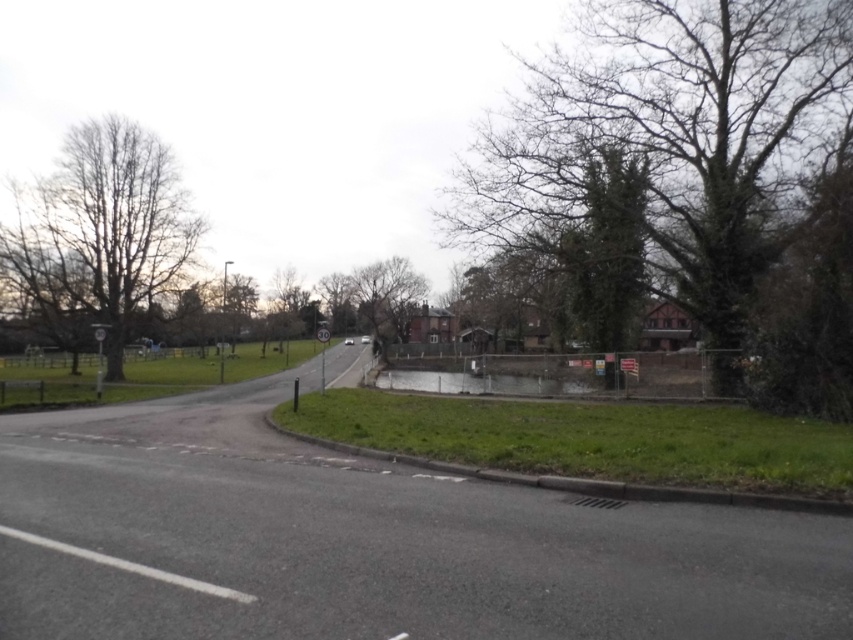
Question: Which point is farther to the camera?

Choices:
 (A) bare wood tree at left
 (B) bare branches at upper right

Answer: (A)

Question: Can you confirm if bare branches at upper right is positioned above bare wood tree at left?

Choices:
 (A) no
 (B) yes

Answer: (B)

Question: Which object is closer to the camera taking this photo?

Choices:
 (A) bare branches at upper right
 (B) bare wood tree at left

Answer: (A)

Question: Which of the following is the farthest from the observer?

Choices:
 (A) bare branches at upper right
 (B) bare wood tree at left

Answer: (B)

Question: Does bare branches at upper right appear over bare wood tree at left?

Choices:
 (A) yes
 (B) no

Answer: (A)

Question: Does bare branches at upper right have a larger size compared to bare wood tree at left?

Choices:
 (A) yes
 (B) no

Answer: (A)